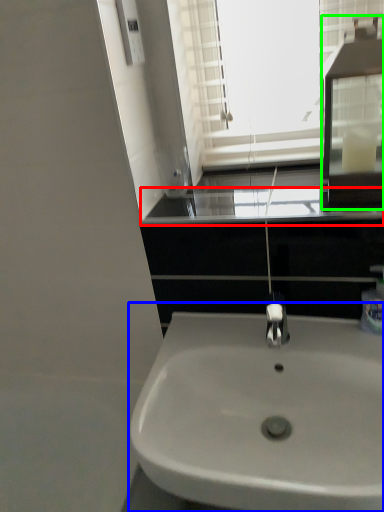
Question: Which object is the closest to the window sill (highlighted by a red box)? Choose among these: sink (highlighted by a blue box) or medicine cabinet (highlighted by a green box).

Choices:
 (A) sink
 (B) medicine cabinet

Answer: (B)